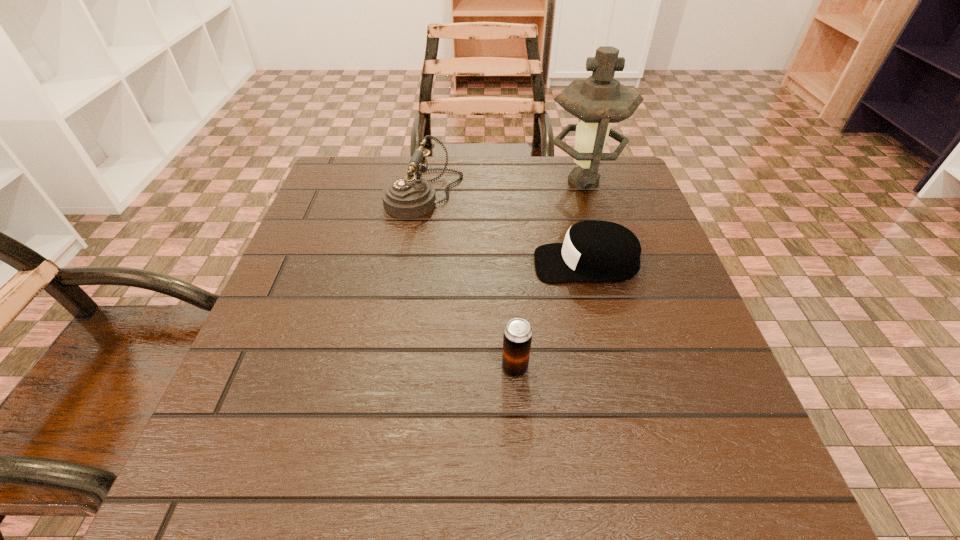
Identify the location of vacant space at the far edge of the desktop. The image size is (960, 540). (497, 181).

Where is `free space at the left edge of the desktop`? The height and width of the screenshot is (540, 960). free space at the left edge of the desktop is located at coordinates (235, 415).

You are a GUI agent. You are given a task and a screenshot of the screen. Output one action in this format:
    pyautogui.click(x=<x>, y=<y>)
    Task: Click on the free space at the right edge of the desktop
    
    Given the screenshot: What is the action you would take?
    pyautogui.click(x=658, y=242)

Where is `vacant region at the far left corner of the desktop`? vacant region at the far left corner of the desktop is located at coordinates (345, 200).

The width and height of the screenshot is (960, 540). I want to click on blank space at the near left corner of the desktop, so 201,495.

Identify the location of free point at the far right corner. (632, 176).

Locate an element on the screen. The height and width of the screenshot is (540, 960). vacant area that lies between the telephone and the nearest object is located at coordinates (469, 281).

Locate an element on the screen. vacant area that lies between the telephone and the tallest object is located at coordinates (504, 188).

Locate an element on the screen. This screenshot has width=960, height=540. free space between the third shortest object and the beer can is located at coordinates (469, 281).

Identify the location of free space between the second tallest object and the tallest object. The height and width of the screenshot is (540, 960). (504, 188).